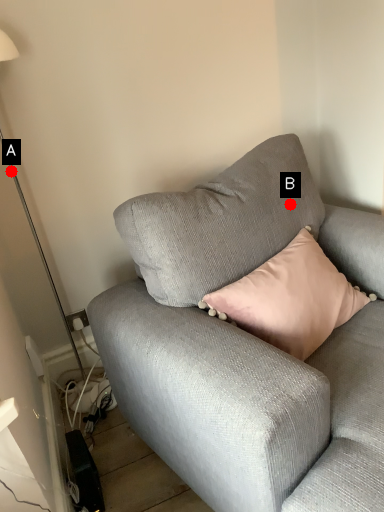
Question: Two points are circled on the image, labeled by A and B beside each circle. Which point is farther from the camera taking this photo?

Choices:
 (A) A is further
 (B) B is further

Answer: (A)